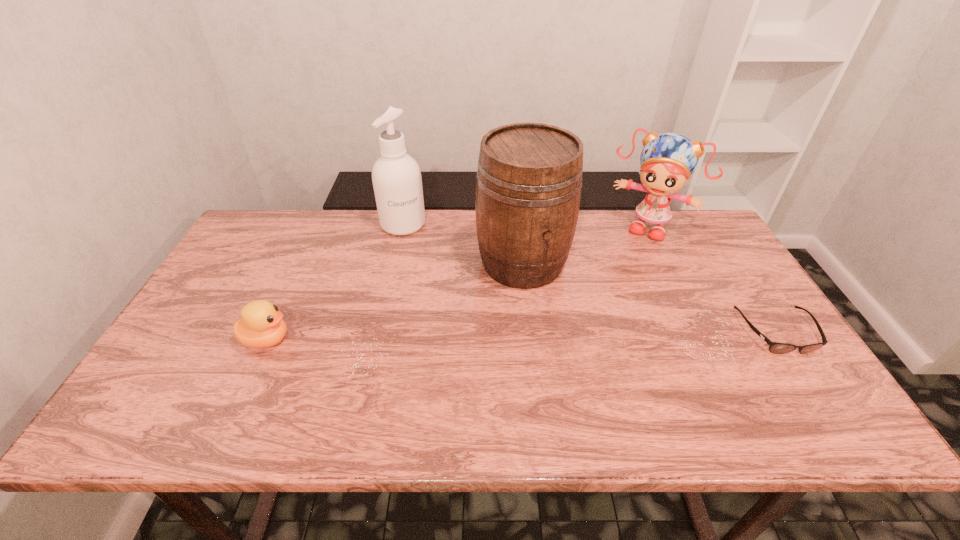
Find the location of a particular element. the fourth tallest object is located at coordinates (261, 326).

Locate an element on the screen. the leftmost object is located at coordinates (261, 326).

Locate an element on the screen. The width and height of the screenshot is (960, 540). sunglasses is located at coordinates (777, 348).

The width and height of the screenshot is (960, 540). I want to click on cider, so click(529, 179).

Where is `the fourth object from right to left`? Image resolution: width=960 pixels, height=540 pixels. the fourth object from right to left is located at coordinates (396, 176).

This screenshot has height=540, width=960. What are the coordinates of `doll` in the screenshot? It's located at (667, 160).

Identify the location of free space located 0.120m on the face of the leftmost object. (340, 340).

Locate an element on the screen. free spot located 0.130m on the side of the third object from left to right near the bung hole is located at coordinates (561, 327).

Where is `vacant position located on the side of the third object from left to right near the bung hole`? The width and height of the screenshot is (960, 540). vacant position located on the side of the third object from left to right near the bung hole is located at coordinates (600, 394).

The image size is (960, 540). Identify the location of vacant position located on the side of the third object from left to right near the bung hole. (564, 333).